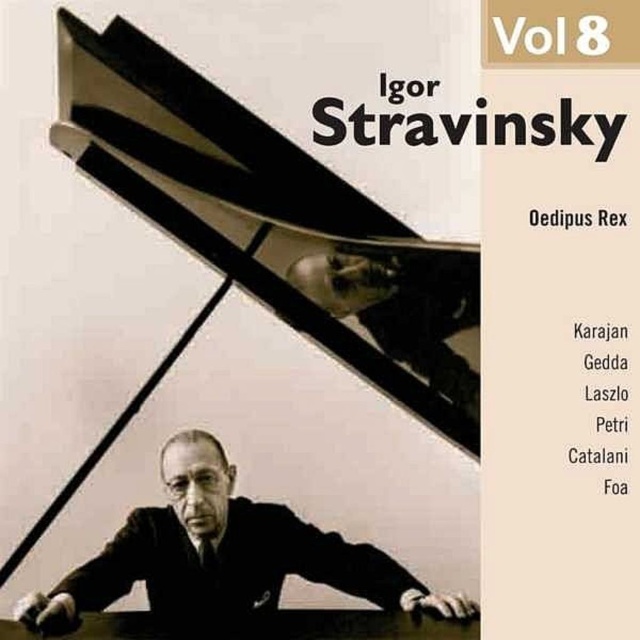
Question: Can you confirm if black polished piano at center is smaller than black matte suit at center?

Choices:
 (A) no
 (B) yes

Answer: (A)

Question: Among these objects, which one is nearest to the camera?

Choices:
 (A) black matte suit at center
 (B) black polished piano at center
 (C) matte black conductor at center

Answer: (B)

Question: Which of these objects is positioned farthest from the black matte suit at center?

Choices:
 (A) black polished piano at center
 (B) matte black conductor at center

Answer: (B)

Question: Can you confirm if black matte suit at center is positioned to the left of matte black conductor at center?

Choices:
 (A) no
 (B) yes

Answer: (B)

Question: Can you confirm if black polished piano at center is wider than matte black conductor at center?

Choices:
 (A) no
 (B) yes

Answer: (B)

Question: Which is nearer to the black polished piano at center?

Choices:
 (A) matte black conductor at center
 (B) black matte suit at center

Answer: (B)